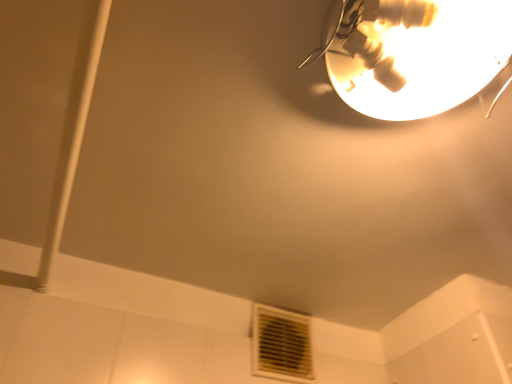
Question: Considering the relative sizes of white plastic air conditioning at lower center and metallic gold lampshade at upper right in the image provided, is white plastic air conditioning at lower center bigger than metallic gold lampshade at upper right?

Choices:
 (A) yes
 (B) no

Answer: (B)

Question: Considering the relative positions of white plastic air conditioning at lower center and metallic gold lampshade at upper right in the image provided, is white plastic air conditioning at lower center behind metallic gold lampshade at upper right?

Choices:
 (A) yes
 (B) no

Answer: (A)

Question: Is white plastic air conditioning at lower center at the left side of metallic gold lampshade at upper right?

Choices:
 (A) yes
 (B) no

Answer: (A)

Question: Would you say white plastic air conditioning at lower center is outside metallic gold lampshade at upper right?

Choices:
 (A) yes
 (B) no

Answer: (A)

Question: Does white plastic air conditioning at lower center have a smaller size compared to metallic gold lampshade at upper right?

Choices:
 (A) yes
 (B) no

Answer: (A)

Question: Is the position of white plastic air conditioning at lower center less distant than that of metallic gold lampshade at upper right?

Choices:
 (A) yes
 (B) no

Answer: (B)

Question: From a real-world perspective, is metallic gold lampshade at upper right located higher than white plastic air conditioning at lower center?

Choices:
 (A) yes
 (B) no

Answer: (A)

Question: Is white plastic air conditioning at lower center a part of metallic gold lampshade at upper right?

Choices:
 (A) yes
 (B) no

Answer: (B)

Question: Is metallic gold lampshade at upper right positioned in front of white plastic air conditioning at lower center?

Choices:
 (A) no
 (B) yes

Answer: (B)

Question: Is metallic gold lampshade at upper right taller than white plastic air conditioning at lower center?

Choices:
 (A) no
 (B) yes

Answer: (A)

Question: Is metallic gold lampshade at upper right looking in the opposite direction of white plastic air conditioning at lower center?

Choices:
 (A) no
 (B) yes

Answer: (B)

Question: From the image's perspective, is metallic gold lampshade at upper right on white plastic air conditioning at lower center?

Choices:
 (A) yes
 (B) no

Answer: (A)

Question: In terms of height, does metallic gold lampshade at upper right look taller or shorter compared to white plastic air conditioning at lower center?

Choices:
 (A) short
 (B) tall

Answer: (A)